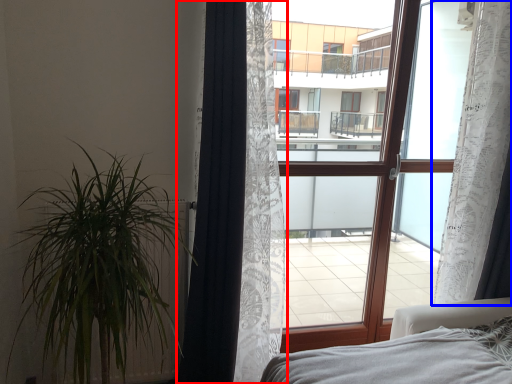
Question: Which of the following is the farthest to the observer, curtain (highlighted by a red box) or curtain (highlighted by a blue box)?

Choices:
 (A) curtain
 (B) curtain

Answer: (B)